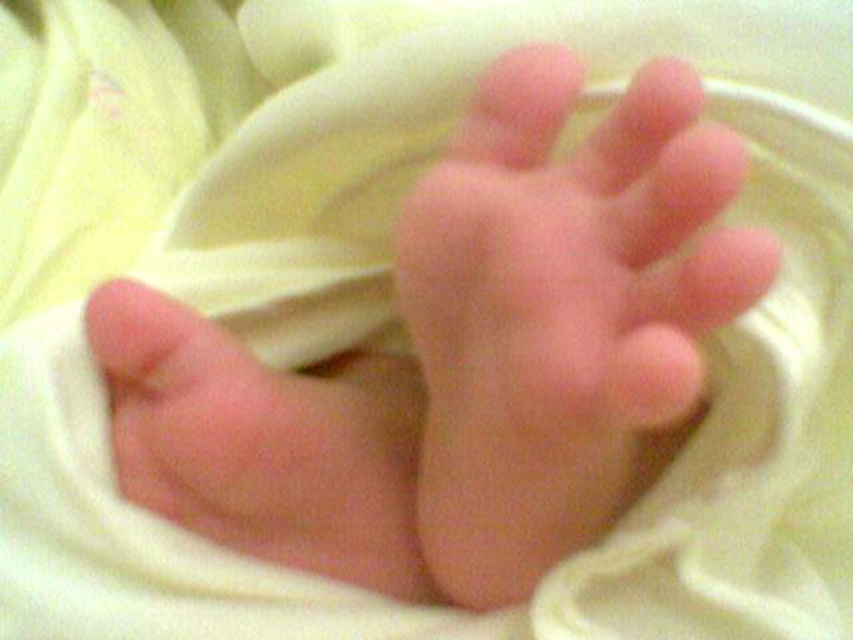
Who is positioned more to the left, pink smooth skin at center or pink smooth skin at lower left?

Positioned to the left is pink smooth skin at lower left.

The height and width of the screenshot is (640, 853). In order to click on pink smooth skin at center in this screenshot , I will do `click(463, 356)`.